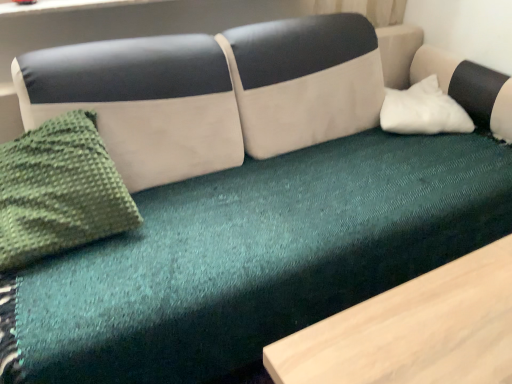
Question: Is white soft pillow at right not near green knitted throw pillow at left?

Choices:
 (A) no
 (B) yes

Answer: (B)

Question: Can you confirm if white soft pillow at right is positioned to the right of green knitted throw pillow at left?

Choices:
 (A) yes
 (B) no

Answer: (A)

Question: Considering the relative sizes of white soft pillow at right and green knitted throw pillow at left in the image provided, is white soft pillow at right bigger than green knitted throw pillow at left?

Choices:
 (A) no
 (B) yes

Answer: (A)

Question: From a real-world perspective, is white soft pillow at right located higher than green knitted throw pillow at left?

Choices:
 (A) yes
 (B) no

Answer: (B)

Question: Is white soft pillow at right completely or partially outside of green knitted throw pillow at left?

Choices:
 (A) yes
 (B) no

Answer: (A)

Question: From the image's perspective, does white soft pillow at right appear higher than green knitted throw pillow at left?

Choices:
 (A) yes
 (B) no

Answer: (A)

Question: From a real-world perspective, is green knitted throw pillow at left over white soft pillow at right?

Choices:
 (A) no
 (B) yes

Answer: (B)

Question: Is green knitted throw pillow at left outside of white soft pillow at right?

Choices:
 (A) no
 (B) yes

Answer: (B)

Question: Can you confirm if green knitted throw pillow at left is positioned to the left of white soft pillow at right?

Choices:
 (A) no
 (B) yes

Answer: (B)

Question: Is the depth of green knitted throw pillow at left less than that of white soft pillow at right?

Choices:
 (A) no
 (B) yes

Answer: (B)

Question: Is green knitted throw pillow at left surrounding white soft pillow at right?

Choices:
 (A) no
 (B) yes

Answer: (A)

Question: Considering the relative sizes of green knitted throw pillow at left and white soft pillow at right in the image provided, is green knitted throw pillow at left thinner than white soft pillow at right?

Choices:
 (A) yes
 (B) no

Answer: (A)

Question: From the image's perspective, is green knitted throw pillow at left positioned above or below white soft pillow at right?

Choices:
 (A) above
 (B) below

Answer: (B)